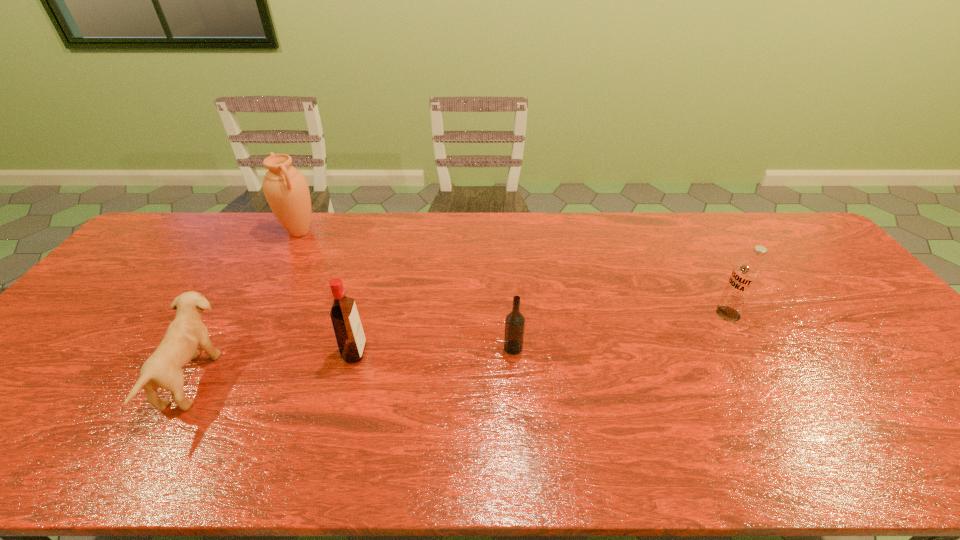
Find the location of a particular element. urn is located at coordinates (286, 190).

Where is `the leftmost vodka`? The width and height of the screenshot is (960, 540). the leftmost vodka is located at coordinates (348, 329).

Locate an element on the screen. The height and width of the screenshot is (540, 960). the farthest vodka is located at coordinates (746, 277).

The image size is (960, 540). I want to click on the rightmost vodka, so click(746, 277).

Find the location of `the shortest vodka`. the shortest vodka is located at coordinates (515, 322).

The height and width of the screenshot is (540, 960). Identify the location of the second vodka from left to right. click(515, 322).

Locate an element on the screen. This screenshot has height=540, width=960. puppy is located at coordinates (186, 332).

Identify the location of free region located 0.320m on the front of the farthest object. (257, 312).

Where is `free spot located 0.050m on the front and back of the third object from left to right`? This screenshot has height=540, width=960. free spot located 0.050m on the front and back of the third object from left to right is located at coordinates (385, 353).

Locate an element on the screen. This screenshot has height=540, width=960. vacant area located on the front label of the rightmost object is located at coordinates (600, 314).